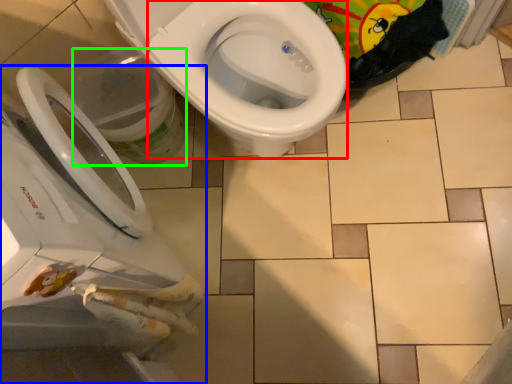
Question: Which object is the farthest from bidet (highlighted by a red box)? Choose among these: toilet (highlighted by a blue box) or potty (highlighted by a green box).

Choices:
 (A) toilet
 (B) potty

Answer: (A)